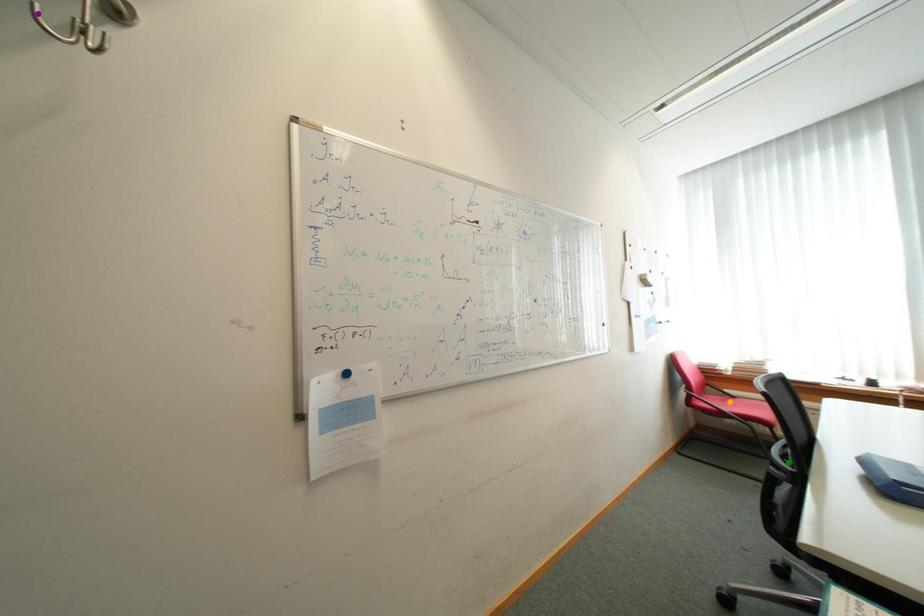
Order these from nearest to farthest:
A) purple point
B) orange point
C) green point

purple point, green point, orange point